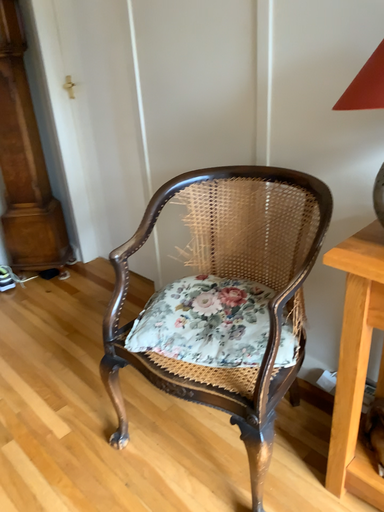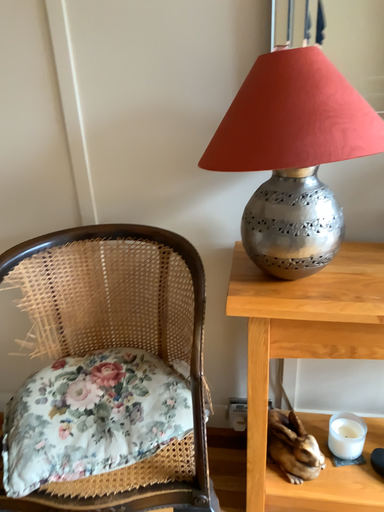
Question: Which way did the camera rotate in the video?

Choices:
 (A) rotated upward
 (B) rotated downward

Answer: (A)